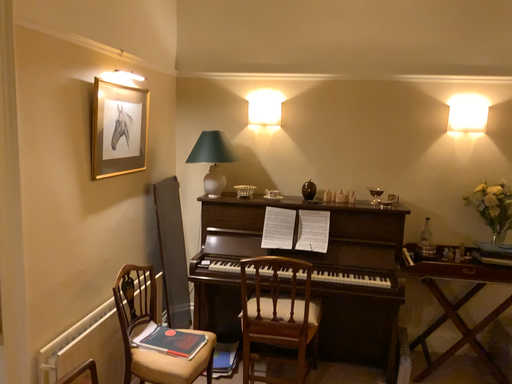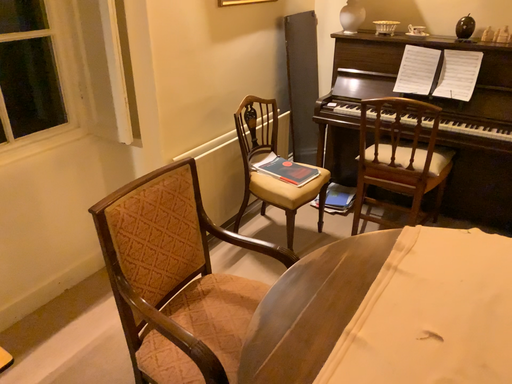
Question: Which way did the camera rotate in the video?

Choices:
 (A) rotated upward
 (B) rotated downward

Answer: (B)